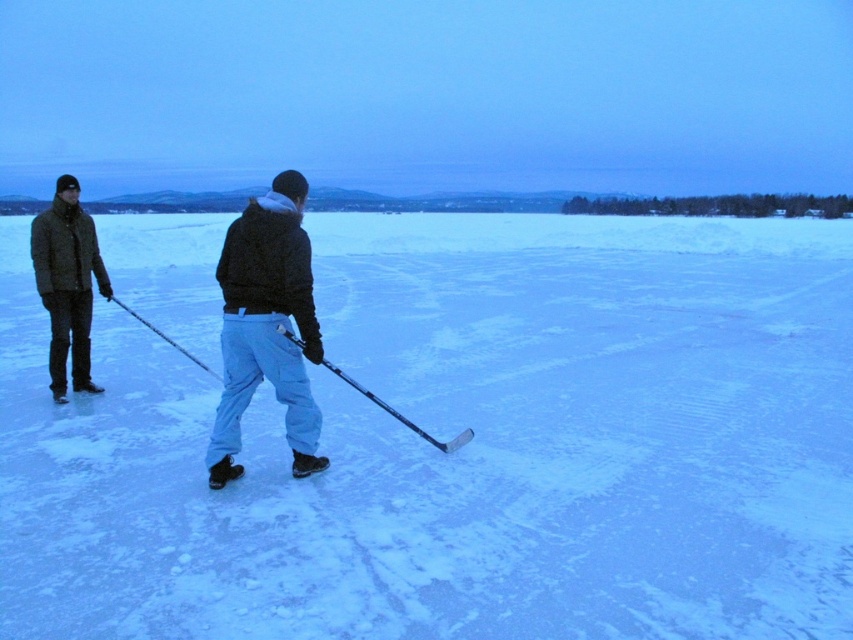
Question: Which of the following is the farthest from the observer?

Choices:
 (A) coord(412,424)
 (B) coord(270,368)

Answer: (A)

Question: Is dark green jacket at left bigger than black glossy hockey stick at center?

Choices:
 (A) yes
 (B) no

Answer: (A)

Question: Among these points, which one is nearest to the camera?

Choices:
 (A) (335, 365)
 (B) (56, 253)
 (C) (259, 221)
 (D) (136, 228)

Answer: (C)

Question: Does white matte snow at center have a lesser width compared to black glossy hockey stick at center?

Choices:
 (A) no
 (B) yes

Answer: (A)

Question: Among these objects, which one is nearest to the camera?

Choices:
 (A) black matte jacket at center
 (B) black glossy hockey stick at center
 (C) dark green jacket at left

Answer: (A)

Question: Can you confirm if black matte jacket at center is positioned to the left of dark green jacket at left?

Choices:
 (A) no
 (B) yes

Answer: (A)